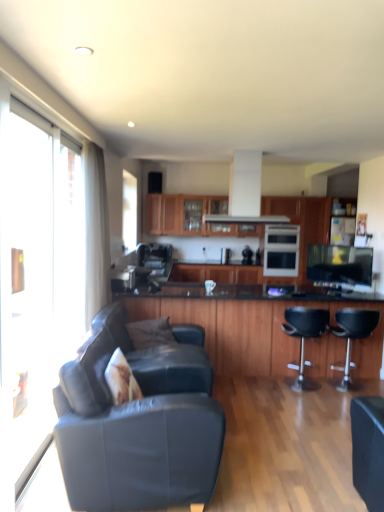
Identify the location of vacant space in front of black leather bar stool at center right, placed as the 2th chair when sorted from right to left. (307, 407).